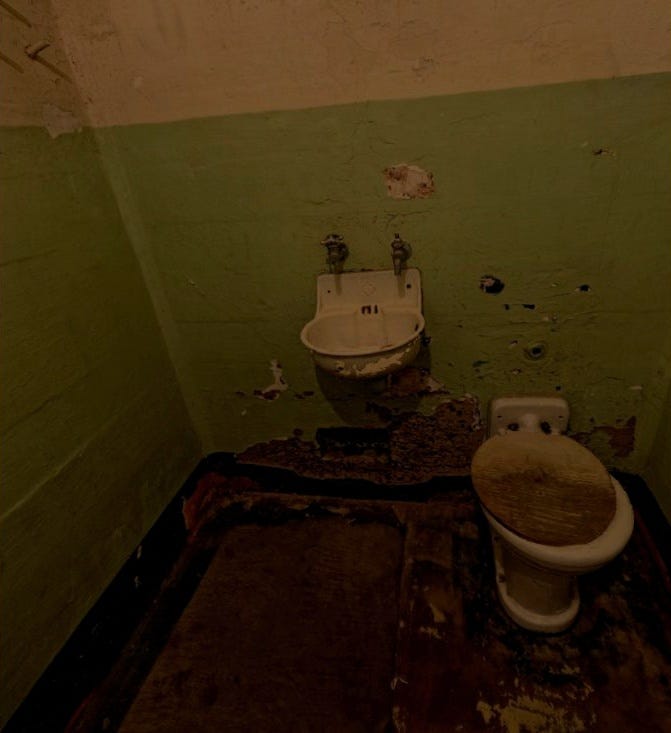
Image resolution: width=671 pixels, height=733 pixels. What are the coordinates of `left wall` in the screenshot? It's located at (66, 517).